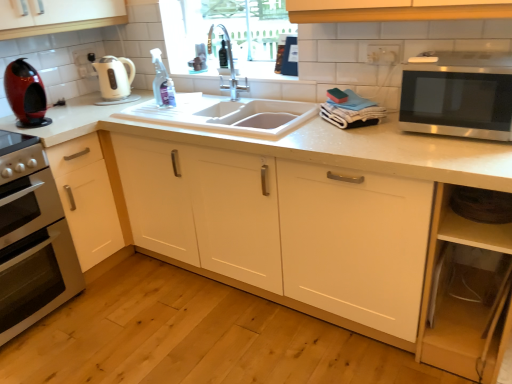
Question: Should I look upward or downward to see stainless steel microwave at right?

Choices:
 (A) down
 (B) up

Answer: (B)

Question: Is white glossy electric kettle at upper left bigger than shiny red coffee machine at left?

Choices:
 (A) no
 (B) yes

Answer: (B)

Question: Is shiny red coffee machine at left at the back of white glossy electric kettle at upper left?

Choices:
 (A) no
 (B) yes

Answer: (A)

Question: Does white glossy electric kettle at upper left have a lesser height compared to shiny red coffee machine at left?

Choices:
 (A) no
 (B) yes

Answer: (B)

Question: Can you confirm if white glossy electric kettle at upper left is smaller than shiny red coffee machine at left?

Choices:
 (A) yes
 (B) no

Answer: (B)

Question: Does white glossy electric kettle at upper left appear on the right side of shiny red coffee machine at left?

Choices:
 (A) no
 (B) yes

Answer: (B)

Question: Can shiny red coffee machine at left be found inside white glossy electric kettle at upper left?

Choices:
 (A) yes
 (B) no

Answer: (B)

Question: Considering the relative sizes of shiny red coffee machine at left and white matte cabinet at center, positioned as the second cabinetry in left-to-right order, in the image provided, is shiny red coffee machine at left wider than white matte cabinet at center, positioned as the second cabinetry in left-to-right order,?

Choices:
 (A) yes
 (B) no

Answer: (B)

Question: Is shiny red coffee machine at left at the right side of white matte cabinet at center, marked as the 1th cabinetry in a right-to-left arrangement?

Choices:
 (A) no
 (B) yes

Answer: (A)

Question: Does shiny red coffee machine at left appear on the left side of white matte cabinet at center, marked as the 1th cabinetry in a right-to-left arrangement?

Choices:
 (A) no
 (B) yes

Answer: (B)

Question: Is shiny red coffee machine at left shorter than white matte cabinet at center, positioned as the second cabinetry in left-to-right order?

Choices:
 (A) no
 (B) yes

Answer: (B)

Question: Is white matte cabinet at center, marked as the 1th cabinetry in a right-to-left arrangement, at the back of shiny red coffee machine at left?

Choices:
 (A) yes
 (B) no

Answer: (B)

Question: Is shiny red coffee machine at left located outside white matte cabinet at center, positioned as the second cabinetry in left-to-right order?

Choices:
 (A) no
 (B) yes

Answer: (B)

Question: Is silver metallic faucet at center turned away from shiny red coffee machine at left?

Choices:
 (A) yes
 (B) no

Answer: (B)